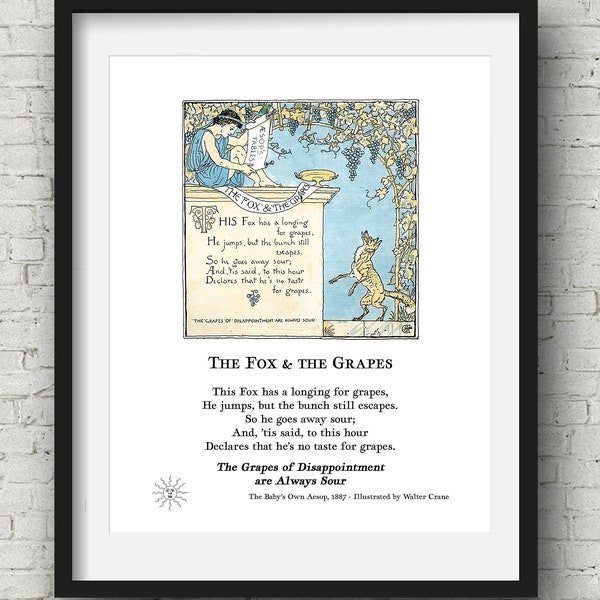
Locate an element on the screen. The image size is (600, 600). wall is located at coordinates (249, 239).